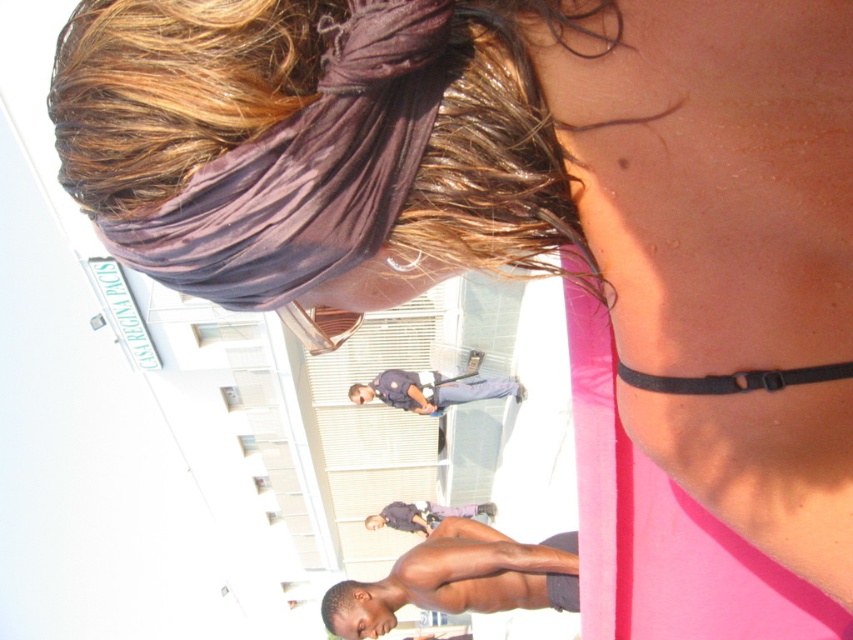
Which of these two, dark purple shirt at center or smooth skin head at lower center, stands shorter?

With less height is smooth skin head at lower center.

Can you confirm if dark purple shirt at center is shorter than smooth skin head at lower center?

No, dark purple shirt at center is not shorter than smooth skin head at lower center.

Is point (396, 522) positioned after point (351, 621)?

Yes, point (396, 522) is behind point (351, 621).

Identify the location of dark purple shirt at center. Image resolution: width=853 pixels, height=640 pixels. (422, 515).

Is dark blue uniform at center taller than dark purple shirt at center?

Incorrect, dark blue uniform at center's height is not larger of dark purple shirt at center's.

Which is below, dark blue uniform at center or dark purple shirt at center?

dark purple shirt at center is below.

Which is behind, point (436, 412) or point (396, 529)?

Point (396, 529)

Where is `dark blue uniform at center`? dark blue uniform at center is located at coordinates (431, 388).

Consider the image. Between purple satin headband at upper center and smooth skin head at lower center, which one has less height?

With less height is smooth skin head at lower center.

Where is `purple satin headband at upper center`? The image size is (853, 640). purple satin headband at upper center is located at coordinates (315, 138).